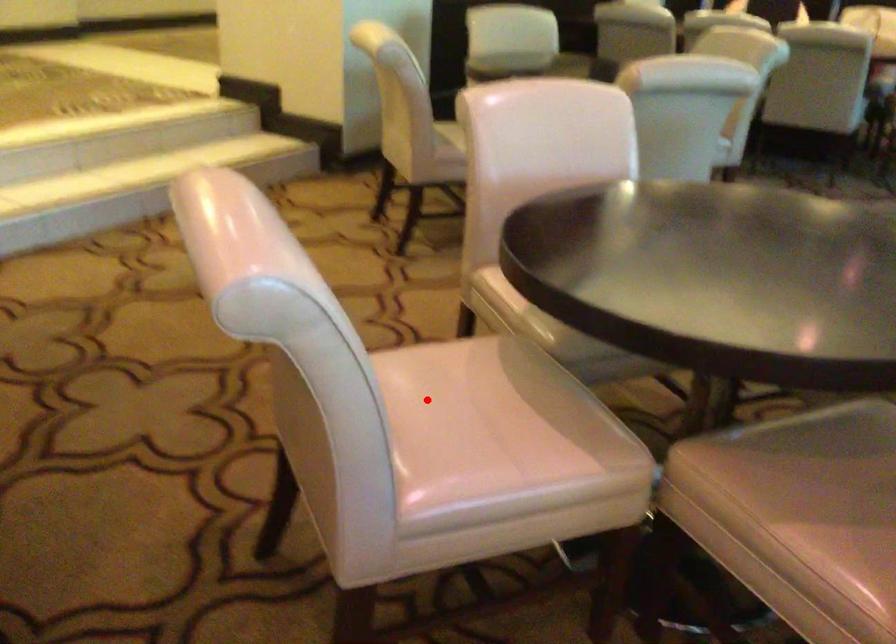
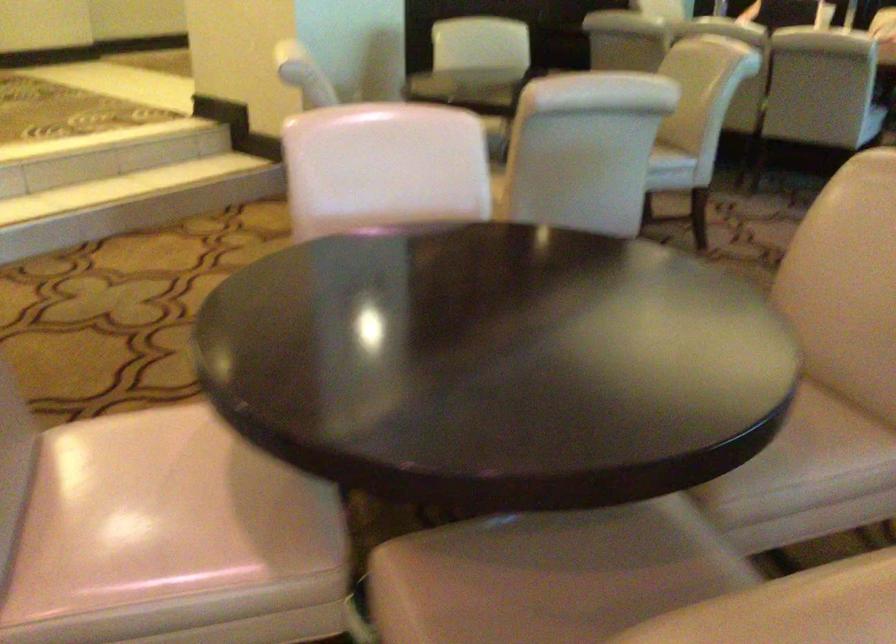
Locate, in the second image, the point that corresponds to the highlighted location in the first image.

(135, 476)